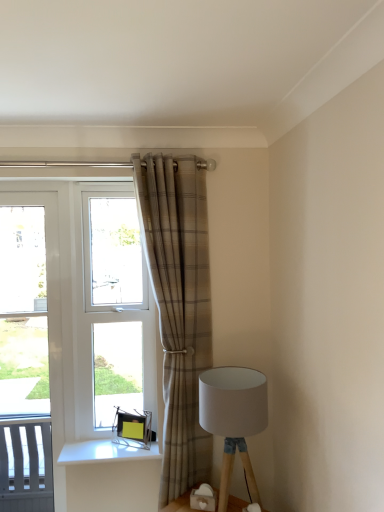
Question: Can you confirm if clear glass window at center is positioned to the right of plaid fabric curtain at center?

Choices:
 (A) no
 (B) yes

Answer: (A)

Question: From a real-world perspective, is clear glass window at center on top of plaid fabric curtain at center?

Choices:
 (A) no
 (B) yes

Answer: (B)

Question: Is clear glass window at center wider than plaid fabric curtain at center?

Choices:
 (A) yes
 (B) no

Answer: (B)

Question: Does clear glass window at center come behind plaid fabric curtain at center?

Choices:
 (A) yes
 (B) no

Answer: (A)

Question: Is plaid fabric curtain at center inside clear glass window at center?

Choices:
 (A) yes
 (B) no

Answer: (B)

Question: Considering the relative sizes of clear glass window at center and plaid fabric curtain at center in the image provided, is clear glass window at center bigger than plaid fabric curtain at center?

Choices:
 (A) no
 (B) yes

Answer: (A)

Question: Is plaid fabric curtain at center closer to camera compared to clear glass window at center?

Choices:
 (A) no
 (B) yes

Answer: (B)

Question: Considering the relative sizes of plaid fabric curtain at center and clear glass window at center in the image provided, is plaid fabric curtain at center smaller than clear glass window at center?

Choices:
 (A) no
 (B) yes

Answer: (A)

Question: Would you say plaid fabric curtain at center is a long distance from clear glass window at center?

Choices:
 (A) no
 (B) yes

Answer: (A)

Question: Can you confirm if plaid fabric curtain at center is taller than clear glass window at center?

Choices:
 (A) no
 (B) yes

Answer: (B)

Question: Does plaid fabric curtain at center touch clear glass window at center?

Choices:
 (A) no
 (B) yes

Answer: (A)

Question: From a real-world perspective, is plaid fabric curtain at center located higher than clear glass window at center?

Choices:
 (A) yes
 (B) no

Answer: (B)

Question: Are white fabric lampshade at lower right and white plastic screen door at left located far from each other?

Choices:
 (A) yes
 (B) no

Answer: (A)